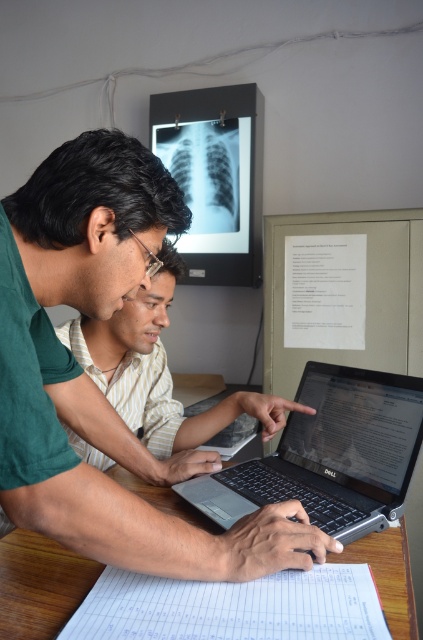
You are a technician needing to reach the point at coordinates point (77, 458) while standing 24 inches away from the laptop. Can you comfortably reach it without moving closer?

The distance between point (77, 458) and the camera is 22.30 inches. Since you are standing 24 inches away, you are slightly farther than the point, so you can comfortably reach it without moving closer.

You are standing 40 inches away from a point marked at coordinates point [321,484]. Can you reach this point without moving your feet?

The distance of point [321,484] from viewer is 36.24 inches, which is within your 40 inches reach. So yes, you can reach the point without moving your feet.

You are a medical student who needs to take notes on the white paper at lower center while looking at the black matte laptop at center. Can you comfortably see both the laptop and the paper at the same time?

The black matte laptop at center is taller than the white paper at lower center, so the student can comfortably see both the laptop and the paper simultaneously since the laptop is positioned higher, allowing for an unobstructed view of the paper below.